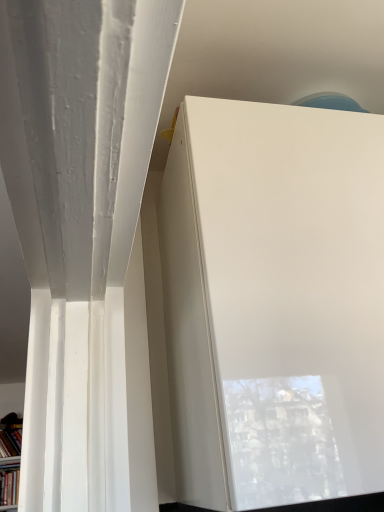
This screenshot has width=384, height=512. Find the location of `white glossy board at upper center`. white glossy board at upper center is located at coordinates (274, 302).

This screenshot has width=384, height=512. Describe the element at coordinates (274, 302) in the screenshot. I see `white glossy board at upper center` at that location.

At what (x,y) coordinates should I click in order to perform the action: click on white glossy board at upper center. Please return your answer as a coordinate pair (x, y). This screenshot has height=512, width=384. Looking at the image, I should click on (274, 302).